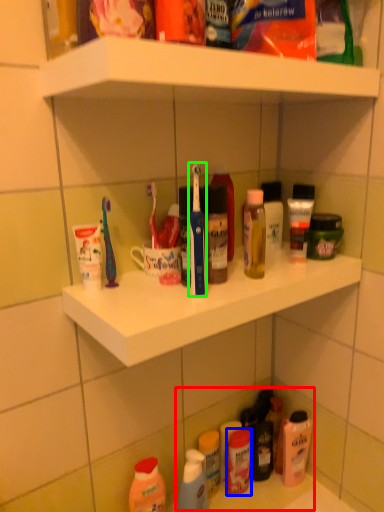
Question: Which object is positioned farthest from product (highlighted by a red box)? Select from toiletry (highlighted by a blue box) and toothbrush (highlighted by a green box).

Choices:
 (A) toiletry
 (B) toothbrush

Answer: (B)